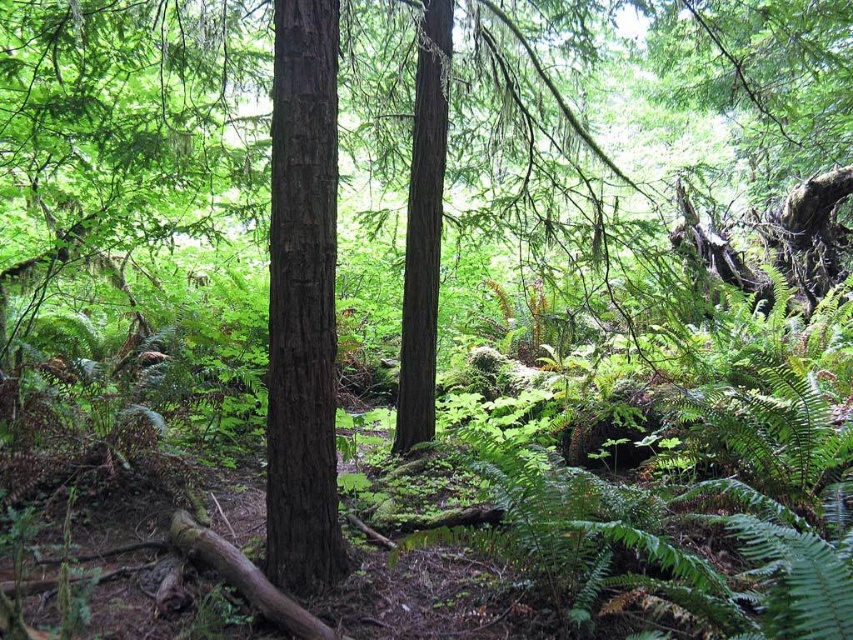
Which of these two, dark brown wood tree at center or smooth brown tree trunk at center, stands taller?

smooth brown tree trunk at center

Does point (271, 320) come behind point (415, 195)?

No, (271, 320) is in front of (415, 195).

Where is `dark brown wood tree at center`? The image size is (853, 640). dark brown wood tree at center is located at coordinates (302, 301).